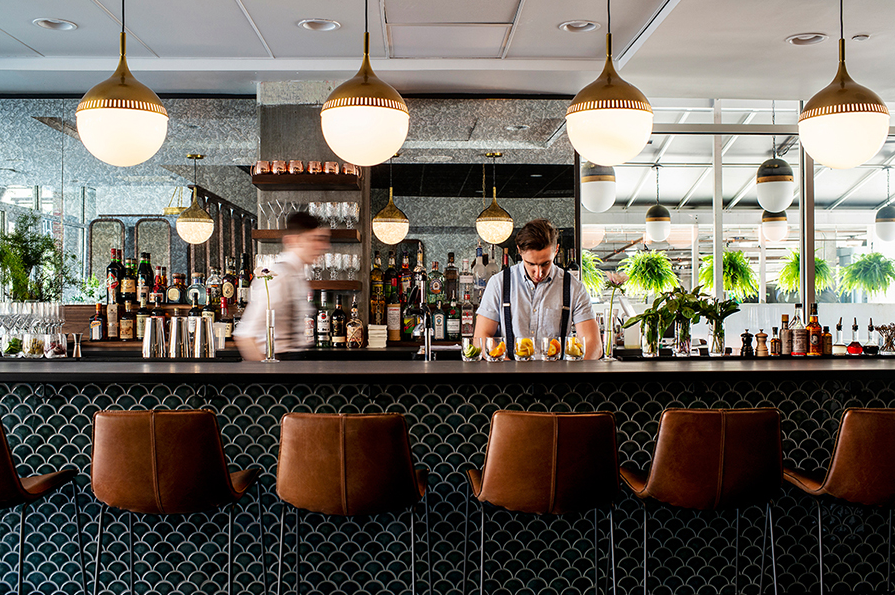
Identify the location of light gray ceiling. Image resolution: width=895 pixels, height=595 pixels. (180, 37).